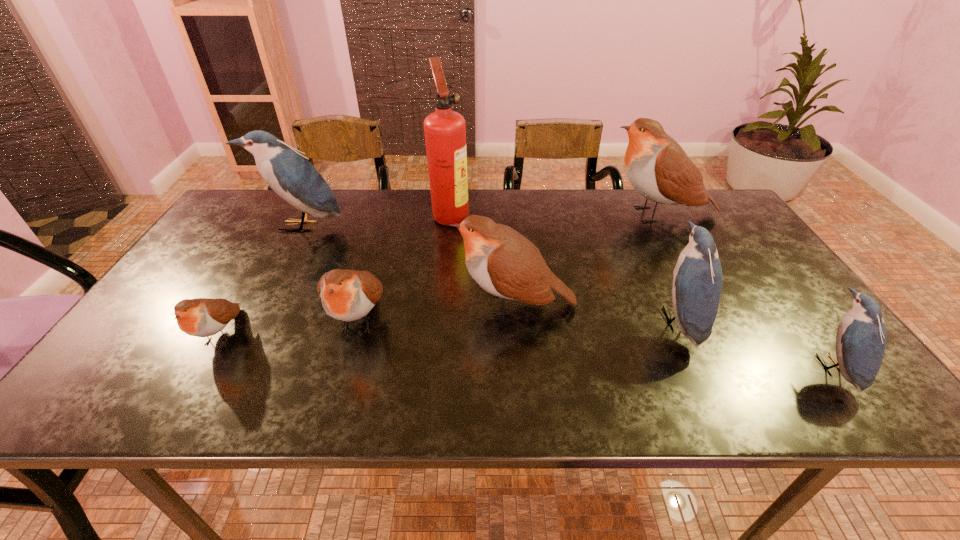
Identify the location of fire extinguisher. (445, 132).

Identify the location of red fire extinguisher. (445, 132).

Where is `the farthest brown bird`? The height and width of the screenshot is (540, 960). the farthest brown bird is located at coordinates (657, 167).

Where is `the rightmost brown bird`? This screenshot has height=540, width=960. the rightmost brown bird is located at coordinates (657, 167).

Identify the location of the biggest blue bird. Image resolution: width=960 pixels, height=540 pixels. (289, 174).

Where is `the farthest blue bird`? The image size is (960, 540). the farthest blue bird is located at coordinates (289, 174).

Find the location of a particular element. the second brown bird from right to left is located at coordinates (503, 262).

At what (x,y) coordinates should I click in order to perform the action: click on the second biggest brown bird. Please return your answer as a coordinate pair (x, y). Looking at the image, I should click on (503, 262).

Locate an element on the screen. The width and height of the screenshot is (960, 540). the second blue bird from right to left is located at coordinates (697, 277).

Where is `the sixth object from right to left`? the sixth object from right to left is located at coordinates (347, 295).